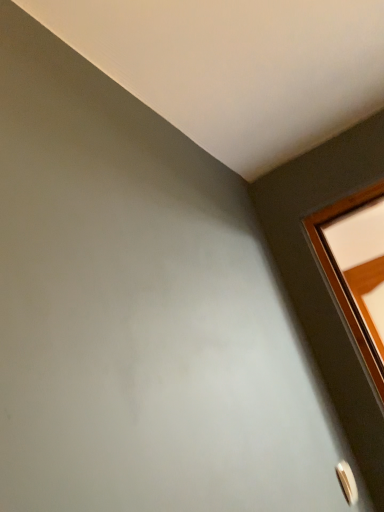
Where is `white glossy door handle at lower right`? white glossy door handle at lower right is located at coordinates (x=347, y=482).

Describe the element at coordinates (347, 482) in the screenshot. The height and width of the screenshot is (512, 384). I see `white glossy door handle at lower right` at that location.

Identify the location of white glossy door handle at lower right. This screenshot has width=384, height=512. (347, 482).